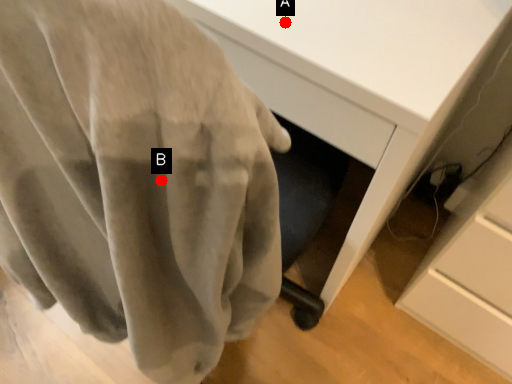
Question: Two points are circled on the image, labeled by A and B beside each circle. Which of the following is the farthest from the observer?

Choices:
 (A) A is further
 (B) B is further

Answer: (A)